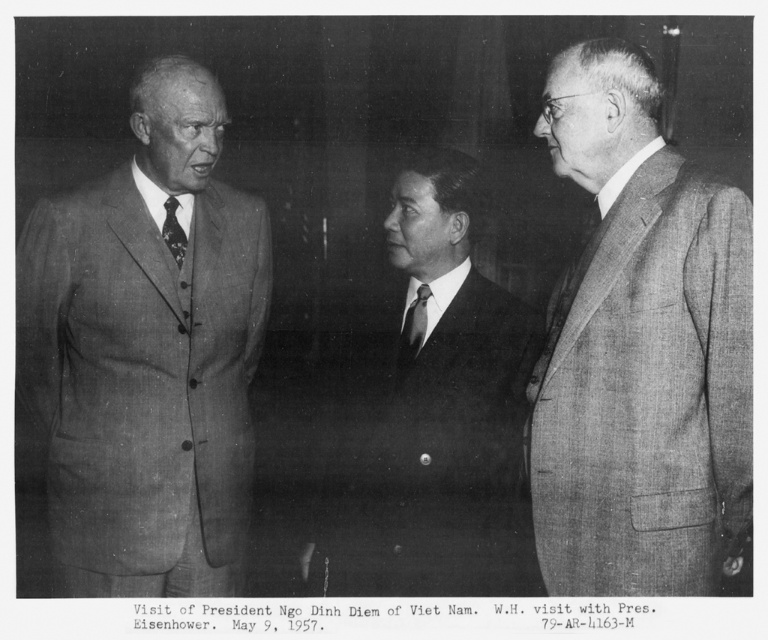
Is point (147, 588) positioned after point (409, 307)?

That is False.

Is point (207, 198) less distant than point (412, 300)?

Yes, point (207, 198) is closer to viewer.

Between point (204, 81) and point (409, 314), which one is positioned behind?

Point (409, 314)

Locate an element on the screen. The width and height of the screenshot is (768, 640). matte gray suit at left is located at coordinates (147, 353).

Between point (111, 593) and point (472, 186), which one is positioned behind?

The point (472, 186) is more distant.

Can you confirm if matte gray suit at left is wider than smooth black suit at center?

Correct, the width of matte gray suit at left exceeds that of smooth black suit at center.

Describe the element at coordinates (147, 353) in the screenshot. I see `matte gray suit at left` at that location.

The width and height of the screenshot is (768, 640). In order to click on matte gray suit at left in this screenshot , I will do `click(147, 353)`.

Which of these two, silky black tie at center or dark blue silk tie at left, stands shorter?

Standing shorter between the two is dark blue silk tie at left.

Does silky black tie at center have a lesser width compared to dark blue silk tie at left?

No.

Does point (399, 346) come behind point (184, 257)?

Yes, point (399, 346) is farther from viewer.

Where is `silky black tie at center`? The image size is (768, 640). silky black tie at center is located at coordinates click(x=412, y=326).